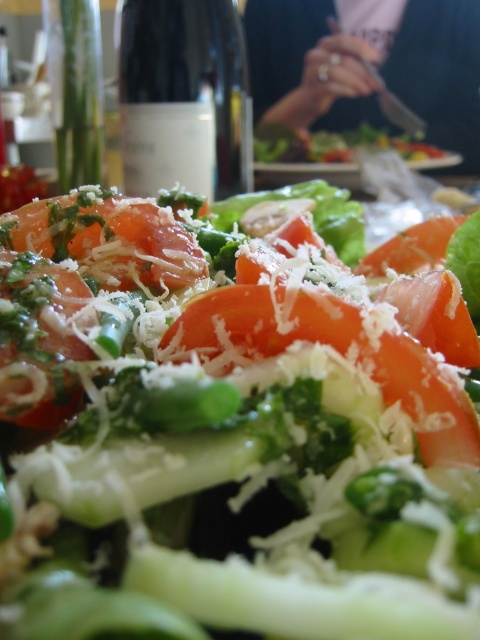
You are at a restaurant and want to choose the bigger tomato between the tomato with grated cheese at center and the tomato with green herbs and grated cheese at center on your salad. Which one should you pick?

The tomato with grated cheese at center is larger in size than the tomato with green herbs and grated cheese at center, so you should pick the tomato with grated cheese at center.

You are a photographer standing at the edge of the table where the salad is placed. You want to capture a close up of the clear glass bottle at upper center without moving your position. Can you focus on the bottle while keeping the salad in the frame?

The clear glass bottle at upper center is 1.33 meters away from camera, so it is possible to focus on the bottle while keeping the salad in the frame as long as the camera has a sufficient zoom capability to capture both the bottle and the salad within the same frame at that distance.

You are setting up a table for a dinner party and want to arrange the clear glass bottle at upper center and the tomato with green herbs and grated cheese at center in a way that the narrower object is placed on the left side. Which object should be placed on the left?

The tomato with green herbs and grated cheese at center should be placed on the left because it is narrower than the clear glass bottle at upper center.